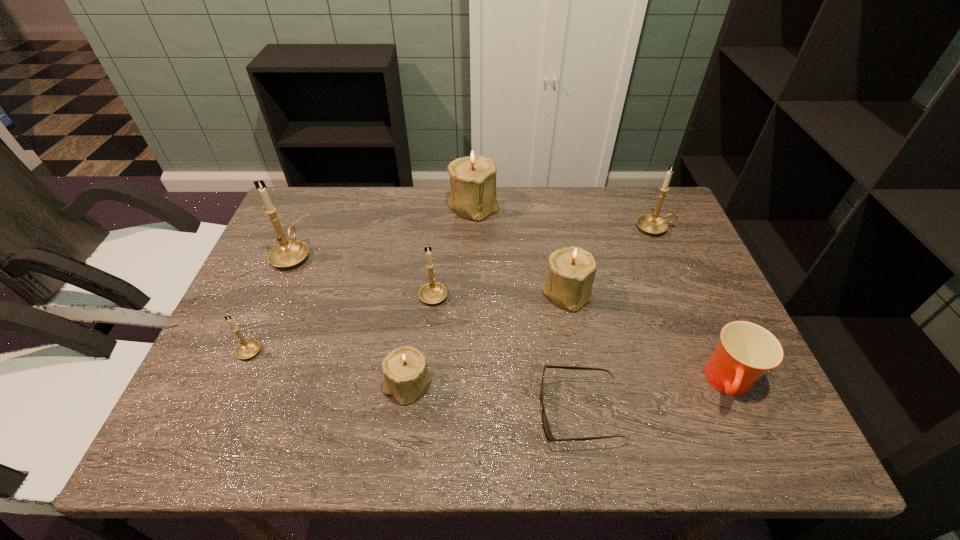
Identify the location of free space located on the lenses of the sunglasses. (495, 411).

You are a GUI agent. You are given a task and a screenshot of the screen. Output one action in this format:
    pyautogui.click(x=<x>, y=<y>)
    Task: Click on the vacant position located 0.300m on the lenses of the sunglasses
    The width and height of the screenshot is (960, 540).
    Given the screenshot: What is the action you would take?
    pyautogui.click(x=392, y=411)

The image size is (960, 540). I want to click on cup that is at the near edge, so click(746, 351).

Find the location of a particular element. sunglasses situated at the near edge is located at coordinates (545, 423).

What are the coordinates of `candle holder at the right edge` in the screenshot? It's located at (650, 223).

Find the location of a particular element. The height and width of the screenshot is (540, 960). cup that is at the right edge is located at coordinates (746, 351).

The height and width of the screenshot is (540, 960). In order to click on object positioned at the far right corner in this screenshot , I will do `click(650, 223)`.

The image size is (960, 540). I want to click on object located at the near right corner, so click(x=746, y=351).

Locate an element on the screen. The width and height of the screenshot is (960, 540). vacant space at the far edge of the desktop is located at coordinates (343, 218).

In the image, there is a desktop. At what (x,y) coordinates should I click in order to perform the action: click on vacant space at the near edge. Please return your answer as a coordinate pair (x, y). Looking at the image, I should click on (516, 443).